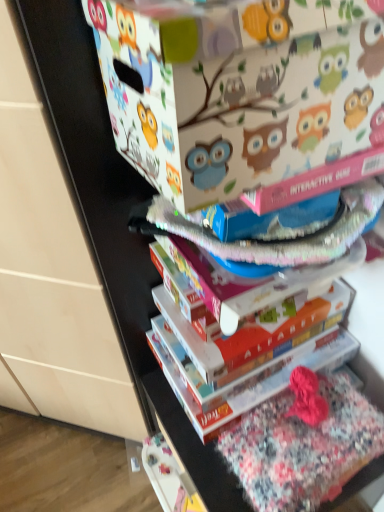
Question: Can you confirm if matte white cardboard box at upper center is positioned to the right of hardcover book at center?

Choices:
 (A) yes
 (B) no

Answer: (B)

Question: From a real-world perspective, is matte white cardboard box at upper center physically above hardcover book at center?

Choices:
 (A) yes
 (B) no

Answer: (A)

Question: Is matte white cardboard box at upper center bigger than hardcover book at center?

Choices:
 (A) no
 (B) yes

Answer: (B)

Question: Considering the relative sizes of matte white cardboard box at upper center and hardcover book at center in the image provided, is matte white cardboard box at upper center taller than hardcover book at center?

Choices:
 (A) yes
 (B) no

Answer: (A)

Question: Is matte white cardboard box at upper center further to the viewer compared to hardcover book at center?

Choices:
 (A) no
 (B) yes

Answer: (A)

Question: In terms of width, does hardcover book at center look wider or thinner when compared to floral cotton fabric at lower right?

Choices:
 (A) wide
 (B) thin

Answer: (A)

Question: From a real-world perspective, is hardcover book at center above or below floral cotton fabric at lower right?

Choices:
 (A) below
 (B) above

Answer: (B)

Question: Would you say hardcover book at center is inside or outside floral cotton fabric at lower right?

Choices:
 (A) inside
 (B) outside

Answer: (B)

Question: From their relative heights in the image, would you say hardcover book at center is taller or shorter than floral cotton fabric at lower right?

Choices:
 (A) tall
 (B) short

Answer: (B)

Question: From the image's perspective, is floral cotton fabric at lower right located above or below matte white cardboard box at upper center?

Choices:
 (A) below
 (B) above

Answer: (A)

Question: In terms of width, does floral cotton fabric at lower right look wider or thinner when compared to matte white cardboard box at upper center?

Choices:
 (A) thin
 (B) wide

Answer: (A)

Question: From a real-world perspective, is floral cotton fabric at lower right above or below matte white cardboard box at upper center?

Choices:
 (A) below
 (B) above

Answer: (A)

Question: Is floral cotton fabric at lower right spatially inside matte white cardboard box at upper center, or outside of it?

Choices:
 (A) outside
 (B) inside

Answer: (A)

Question: Is matte white cardboard box at upper center bigger or smaller than floral cotton fabric at lower right?

Choices:
 (A) small
 (B) big

Answer: (B)

Question: From a real-world perspective, is matte white cardboard box at upper center positioned above or below floral cotton fabric at lower right?

Choices:
 (A) below
 (B) above

Answer: (B)